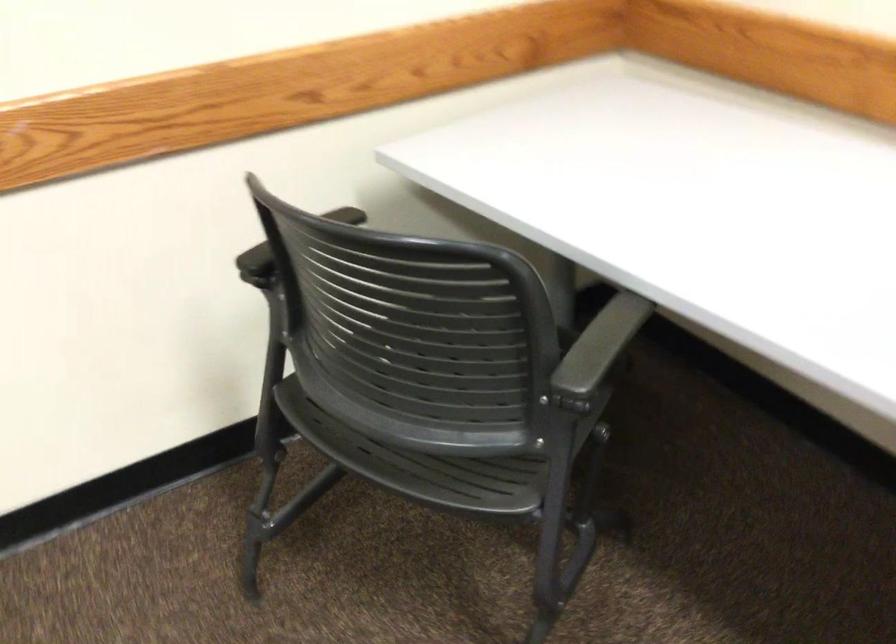
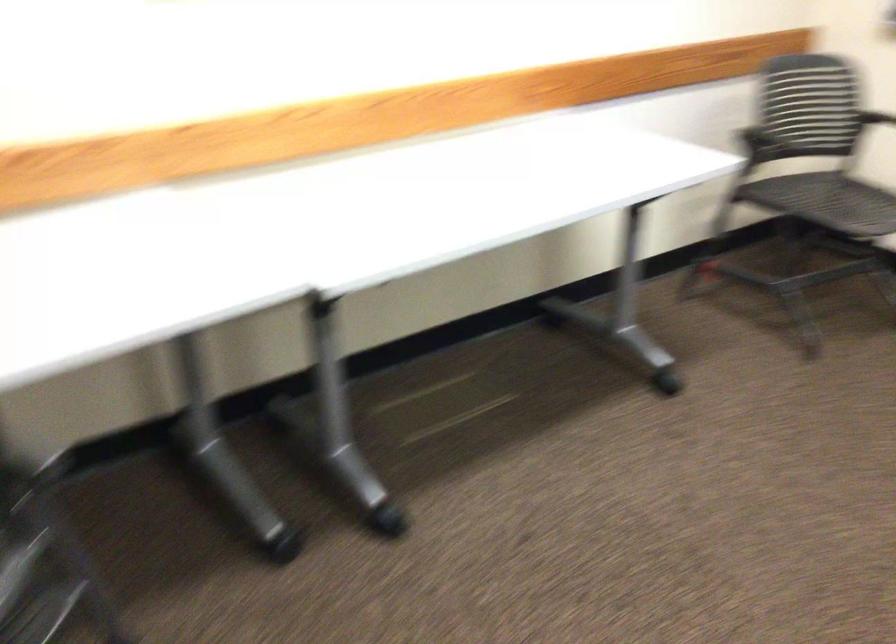
The images are taken continuously from a first-person perspective. In which direction is your viewpoint rotating?

The camera rotated toward right-down.